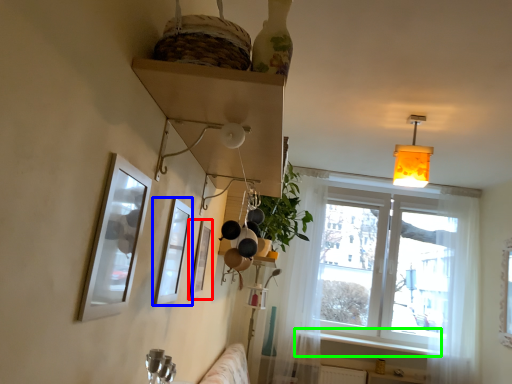
Question: Considering the real-world distances, which object is closest to picture frame (highlighted by a red box)? picture frame (highlighted by a blue box) or window sill (highlighted by a green box).

Choices:
 (A) picture frame
 (B) window sill

Answer: (A)